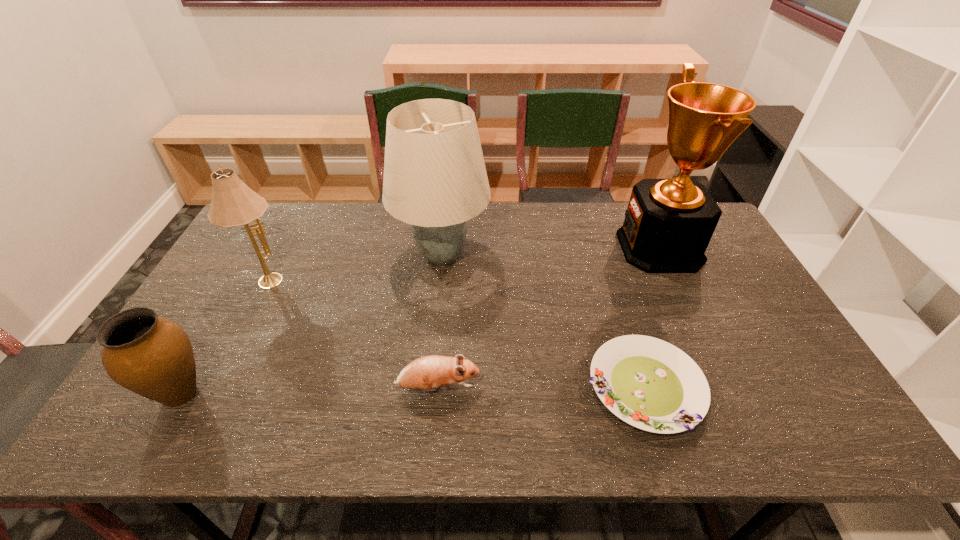
Identify the location of urn located in the left edge section of the desktop. Image resolution: width=960 pixels, height=540 pixels. (151, 356).

This screenshot has width=960, height=540. I want to click on object situated at the right edge, so click(668, 224).

Find the location of `object that is at the near left corner`. object that is at the near left corner is located at coordinates (151, 356).

This screenshot has height=540, width=960. I want to click on object that is at the far right corner, so click(668, 224).

The width and height of the screenshot is (960, 540). I want to click on free space at the far edge of the desktop, so click(x=343, y=212).

In the image, there is a desktop. Where is `vacant space at the near edge`? vacant space at the near edge is located at coordinates point(525,414).

At what (x,y) coordinates should I click in order to perform the action: click on free space at the right edge. Please return your answer as a coordinate pair (x, y). Looking at the image, I should click on (744, 285).

In the image, there is a desktop. What are the coordinates of `free space at the far left corner` in the screenshot? It's located at (276, 218).

Identify the location of vacant area at the near right corner of the desktop. (835, 426).

In order to click on vacant area between the trophy cup and the shorter lampshade in this screenshot , I will do `click(464, 263)`.